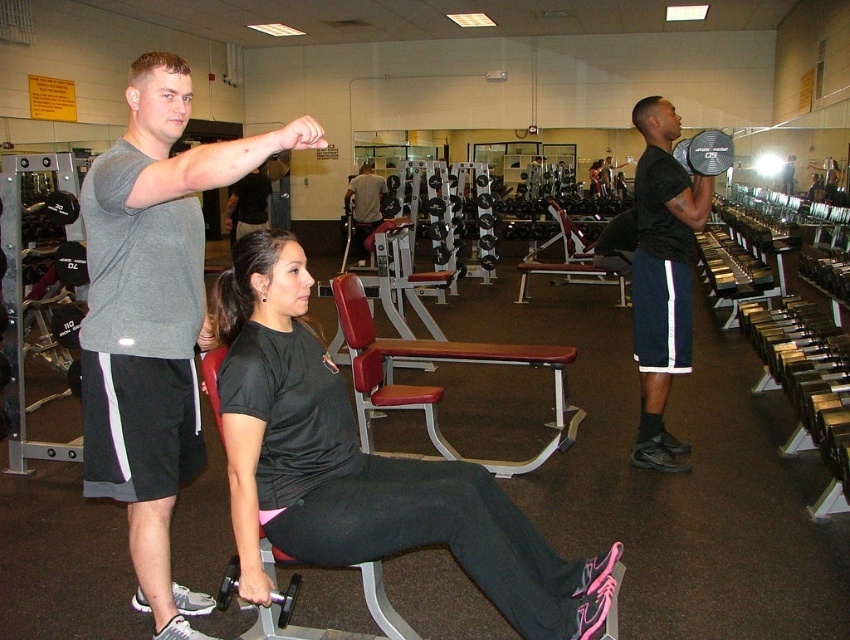
You are a personal trainer standing at the gym entrance and want to hand a client a dumbbell. The client is wearing the black matte shirt at center. Can you reach the black matte dumbbell at right from where the client is standing without moving?

The distance between the black matte shirt at center and the black matte dumbbell at right is 6.20 feet. Since this distance is greater than the typical human arm length of around 2.5 to 3 feet, the client cannot reach the dumbbell without moving closer.

You are a gym trainer observing the scene. You need to adjust the position of the red leather bench at center so that it is no longer below the matte gray shirt at center. Which direction should you move the bench?

To move the red leather bench at center so it is no longer below the matte gray shirt at center, you should move it upwards since the bench is currently positioned below the shirt.